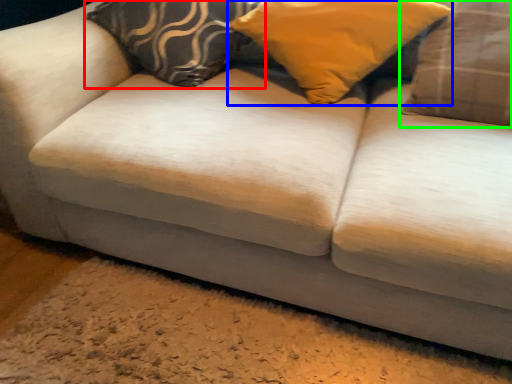
Question: Which object is the farthest from pillow (highlighted by a red box)? Choose among these: pillow (highlighted by a blue box) or pillow (highlighted by a green box).

Choices:
 (A) pillow
 (B) pillow

Answer: (B)